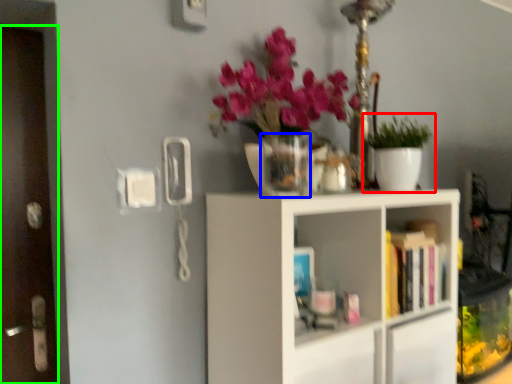
Question: Based on their relative distances, which object is nearer to houseplant (highlighted by a red box)? Choose from vase (highlighted by a blue box) and door (highlighted by a green box).

Choices:
 (A) vase
 (B) door

Answer: (A)